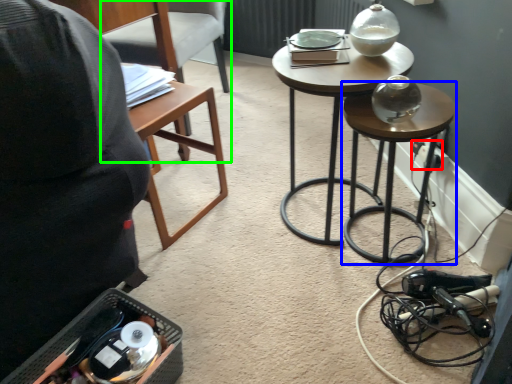
Question: Considering the real-world distances, which object is closest to electric outlet (highlighted by a red box)? stool (highlighted by a blue box) or chair (highlighted by a green box).

Choices:
 (A) stool
 (B) chair

Answer: (A)